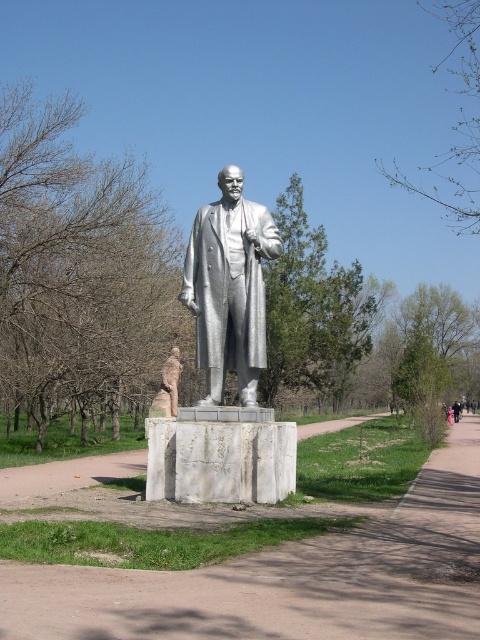
Is white marble path at center wider than silver polished statue at center?

Yes.

Does white marble path at center appear under silver polished statue at center?

Correct, white marble path at center is located below silver polished statue at center.

Does point (177, 582) lie in front of point (184, 278)?

Yes, point (177, 582) is closer to viewer.

You are a GUI agent. You are given a task and a screenshot of the screen. Output one action in this format:
    pyautogui.click(x=<x>, y=<y>)
    Task: Click on the white marble path at center
    The image size is (480, 640).
    Given the screenshot: What is the action you would take?
    pyautogui.click(x=287, y=577)

Is polished silver statue at center below matte bronze statue at center?

No.

Consider the image. Which is more to the right, polished silver statue at center or matte bronze statue at center?

From the viewer's perspective, polished silver statue at center appears more on the right side.

Is point (240, 310) closer to camera compared to point (175, 401)?

Yes, it is in front of point (175, 401).

Where is `polished silver statue at center`? polished silver statue at center is located at coordinates (229, 285).

Between white marble path at center and polished silver statue at center, which one appears on the right side from the viewer's perspective?

white marble path at center is more to the right.

Who is more distant from viewer, (15, 579) or (237, 276)?

Positioned behind is point (237, 276).

Is point (423, 588) less distant than point (229, 264)?

Yes, it is.

You are a GUI agent. You are given a task and a screenshot of the screen. Output one action in this format:
    pyautogui.click(x=<x>, y=<y>)
    Task: Click on the white marble path at center
    Image resolution: width=480 pixels, height=640 pixels.
    Given the screenshot: What is the action you would take?
    pyautogui.click(x=287, y=577)